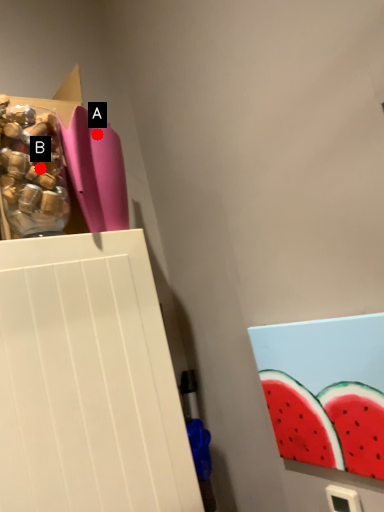
Question: Two points are circled on the image, labeled by A and B beside each circle. Among these points, which one is nearest to the camera?

Choices:
 (A) A is closer
 (B) B is closer

Answer: (B)